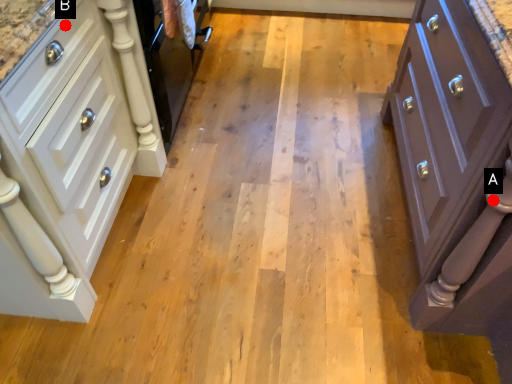
Question: Two points are circled on the image, labeled by A and B beside each circle. Which point is closer to the camera?

Choices:
 (A) A is closer
 (B) B is closer

Answer: (A)